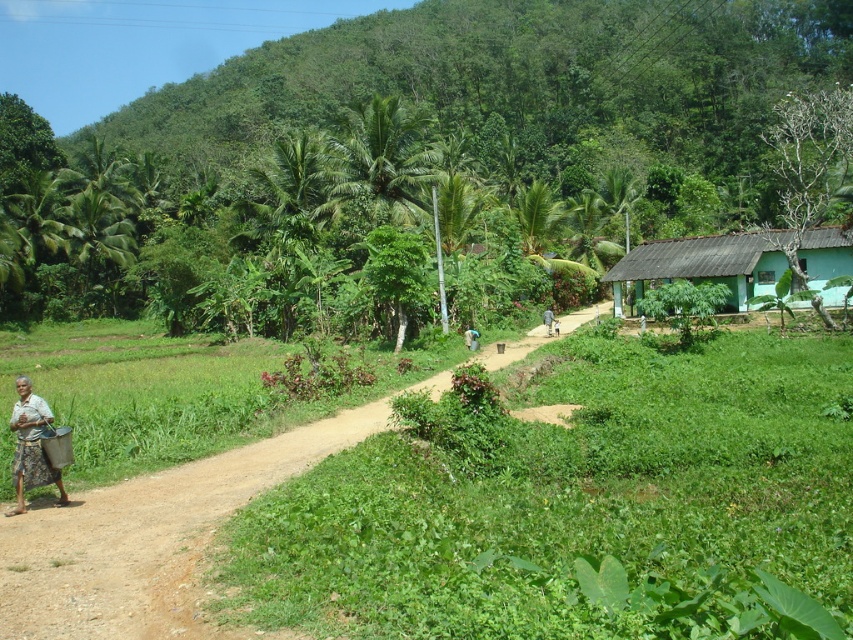
You are a delivery person who needs to carry both the blue fabric bag at center and the brown fabric person at center. Which item requires more space to carry?

The brown fabric person at center requires more space to carry because the blue fabric bag at center occupies less space than it.

You are standing at the point marked as point (x=547, y=316) and want to walk towards the point marked as point (x=468, y=332). Which direction should you move relative to your current position?

You should move upwards because point (x=468, y=332) is closer to the camera than point (x=547, y=316), meaning it is higher in the image.

Looking at this image, you are a photographer trying to capture the scene of the brown fabric person at center and the blue fabric bag at center. Which object should you focus on first if you want to take a clear photo of both without moving the camera?

The blue fabric bag at center is in front of the brown fabric person at center, so you should focus on the blue fabric bag at center first to ensure both are in focus.